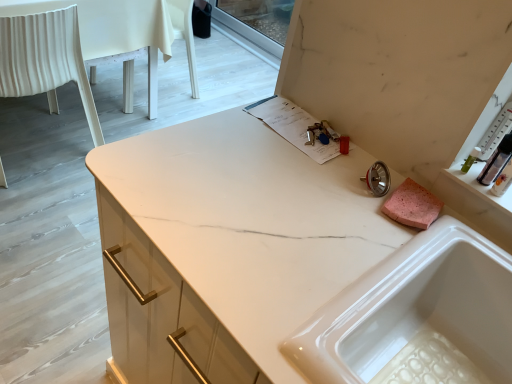
In order to face white marble countertop at center, should I rotate leftwards or rightwards?

You should look right and rotate roughly 3.551 degrees.

Measure the distance between white marble countertop at center and camera.

white marble countertop at center is 23.85 inches away from camera.

Describe the element at coordinates (417, 316) in the screenshot. I see `white glossy sink at upper right` at that location.

This screenshot has height=384, width=512. In order to click on white glossy sink at upper right in this screenshot , I will do pos(417,316).

Locate an element on the screen. clear plastic bottle at upper right is located at coordinates (496, 161).

Find the location of a particular element. white fabric chair at left is located at coordinates (45, 60).

From a real-world perspective, between white glossy sink at upper right and white fabric chair at left, who is vertically higher?

From a 3D spatial view, white glossy sink at upper right is above.

I want to click on sink located in front of the white fabric chair at left, so click(417, 316).

Is white glossy sink at upper right positioned beyond the bounds of white fabric chair at left?

That's correct, white glossy sink at upper right is outside of white fabric chair at left.

Identify the location of countertop above the white fabric chair at left (from a real-world perspective). (283, 265).

From the image's perspective, is white fabric chair at left located above or below white marble countertop at center?

From the image's perspective, white fabric chair at left appears above white marble countertop at center.

Is point (24, 81) positioned after point (249, 126)?

Yes.

From a real-world perspective, is white fabric chair at left beneath white marble countertop at center?

Yes, from a real-world perspective, white fabric chair at left is below white marble countertop at center.

Could you tell me if clear plastic bottle at upper right is turned towards white glossy sink at upper right?

No.

Are clear plastic bottle at upper right and white glossy sink at upper right making contact?

No, clear plastic bottle at upper right is not in contact with white glossy sink at upper right.

Is white glossy sink at upper right a part of clear plastic bottle at upper right?

No, white glossy sink at upper right is not a part of clear plastic bottle at upper right.

Which of these two, clear plastic bottle at upper right or white glossy sink at upper right, stands shorter?

With less height is clear plastic bottle at upper right.

Would you say white fabric chair at left is a long distance from clear plastic bottle at upper right?

Yes, white fabric chair at left is far from clear plastic bottle at upper right.

Based on the photo, does white fabric chair at left come behind clear plastic bottle at upper right?

That is True.

Is white fabric chair at left inside or outside of clear plastic bottle at upper right?

white fabric chair at left is not inside clear plastic bottle at upper right, it's outside.

From a real-world perspective, which object stands above the other?

clear plastic bottle at upper right, from a real-world perspective.

Which is in front, white marble countertop at center or white fabric chair at left?

white marble countertop at center is in front.

Is point (320, 316) farther from camera compared to point (54, 41)?

No, it is in front of (54, 41).

From the image's perspective, which one is positioned higher, white marble countertop at center or white fabric chair at left?

white fabric chair at left is shown above in the image.

In the scene shown: Can white fabric chair at left be found inside white marble countertop at center?

No, white fabric chair at left is not a part of white marble countertop at center.

At what (x,y) coordinates should I click in order to perform the action: click on sink that is on the right side of white marble countertop at center. Please return your answer as a coordinate pair (x, y). This screenshot has height=384, width=512. Looking at the image, I should click on (417, 316).

Is white marble countertop at center far from white glossy sink at upper right?

white marble countertop at center is near white glossy sink at upper right, not far away.

Which of these two, white marble countertop at center or white glossy sink at upper right, is wider?

white marble countertop at center.

Considering the relative positions of white marble countertop at center and white glossy sink at upper right in the image provided, is white marble countertop at center to the left of white glossy sink at upper right from the viewer's perspective?

Correct, you'll find white marble countertop at center to the left of white glossy sink at upper right.

Based on the photo, which object is positioned more to the left, clear plastic bottle at upper right or white marble countertop at center?

white marble countertop at center.

Is clear plastic bottle at upper right turned away from white marble countertop at center?

No, clear plastic bottle at upper right is not facing the opposite direction of white marble countertop at center.

From the image's perspective, would you say clear plastic bottle at upper right is positioned over white marble countertop at center?

Correct, clear plastic bottle at upper right appears higher than white marble countertop at center in the image.

Locate an element on the screen. The image size is (512, 384). chair below the white glossy sink at upper right (from a real-world perspective) is located at coordinates (45, 60).

Locate an element on the screen. The width and height of the screenshot is (512, 384). chair above the white marble countertop at center (from the image's perspective) is located at coordinates (45, 60).

Considering their positions, is white marble countertop at center positioned further to white fabric chair at left than white glossy sink at upper right?

Among the two, white glossy sink at upper right is located further to white fabric chair at left.

Looking at the image, which one is located closer to white marble countertop at center, white glossy sink at upper right or white fabric chair at left?

white glossy sink at upper right.

When comparing their distances from white marble countertop at center, does clear plastic bottle at upper right or white fabric chair at left seem further?

white fabric chair at left lies further to white marble countertop at center than the other object.

Considering their positions, is white fabric chair at left positioned further to white glossy sink at upper right than white marble countertop at center?

The object further to white glossy sink at upper right is white fabric chair at left.

Which object lies further to the anchor point white glossy sink at upper right, clear plastic bottle at upper right or white marble countertop at center?

clear plastic bottle at upper right lies further to white glossy sink at upper right than the other object.

Consider the image. When comparing their distances from white glossy sink at upper right, does white fabric chair at left or clear plastic bottle at upper right seem closer?

clear plastic bottle at upper right lies closer to white glossy sink at upper right than the other object.

From the image, which object appears to be nearer to white fabric chair at left, white glossy sink at upper right or clear plastic bottle at upper right?

The object closer to white fabric chair at left is white glossy sink at upper right.

Considering their positions, is white glossy sink at upper right positioned further to white marble countertop at center than clear plastic bottle at upper right?

clear plastic bottle at upper right is positioned further to the anchor white marble countertop at center.

At what (x,y) coordinates should I click in order to perform the action: click on sink situated between white fabric chair at left and clear plastic bottle at upper right from left to right. Please return your answer as a coordinate pair (x, y). This screenshot has height=384, width=512. Looking at the image, I should click on (417, 316).

This screenshot has height=384, width=512. I want to click on countertop situated between white fabric chair at left and white glossy sink at upper right from left to right, so click(x=283, y=265).

Find the location of `countertop located between white fabric chair at left and clear plastic bottle at upper right in the left-right direction`. countertop located between white fabric chair at left and clear plastic bottle at upper right in the left-right direction is located at coordinates (283, 265).

The width and height of the screenshot is (512, 384). What are the coordinates of `sink between clear plastic bottle at upper right and white marble countertop at center from top to bottom` in the screenshot? It's located at (417, 316).